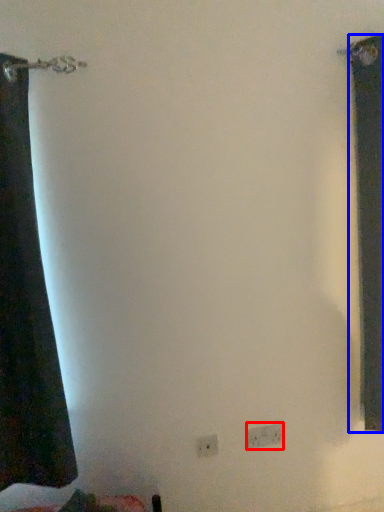
Question: Which object is further to the camera taking this photo, electric outlet (highlighted by a red box) or curtain (highlighted by a blue box)?

Choices:
 (A) electric outlet
 (B) curtain

Answer: (A)